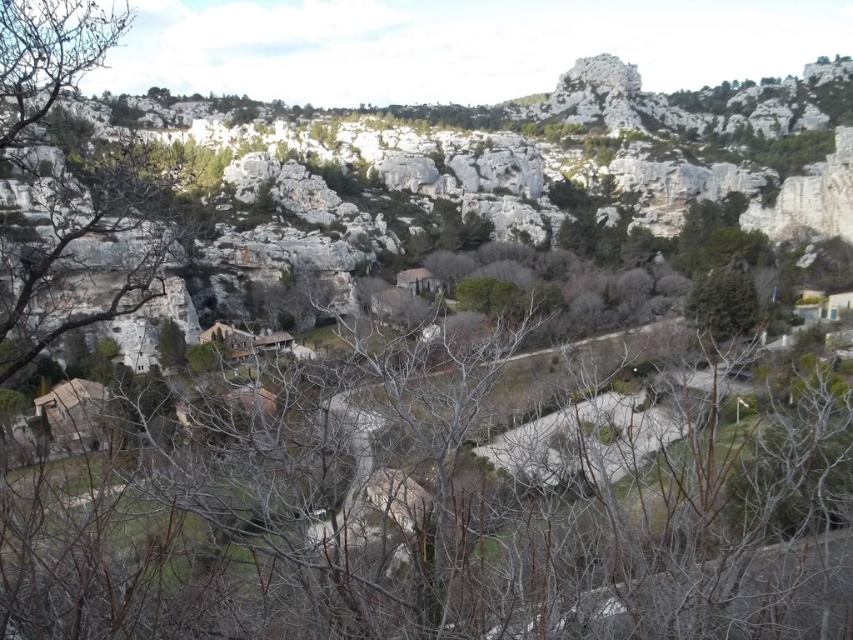
Is brown leafless branches at center above green leafy tree at center?

No, brown leafless branches at center is not above green leafy tree at center.

In the scene shown: Measure the distance between point (502,634) and camera.

Point (502,634) is 62.07 meters from camera.

The height and width of the screenshot is (640, 853). In order to click on brown leafless branches at center in this screenshot , I will do `click(440, 515)`.